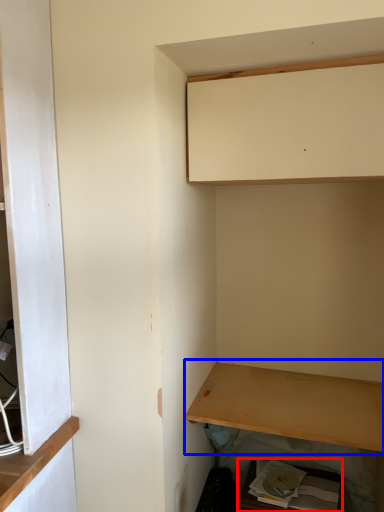
Question: Which object is closer to the camera taking this photo, cabinetry (highlighted by a red box) or shelf (highlighted by a blue box)?

Choices:
 (A) cabinetry
 (B) shelf

Answer: (B)